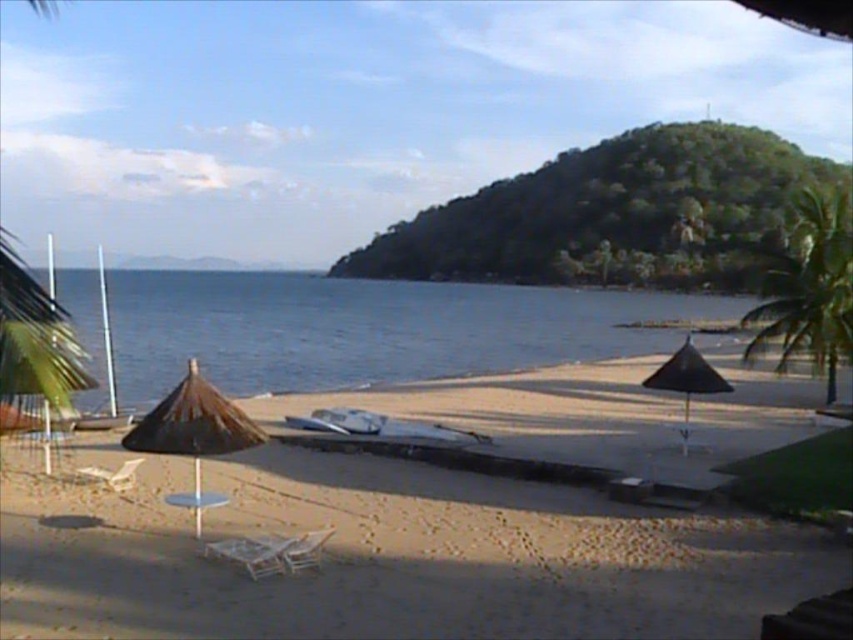
You are standing at the beach and want to place a small flag between the two points, point [187,396] and point [314,557]. Which point is closer to you so that you can reach it first?

Point [187,396] is further to the camera than point [314,557], so point [314,557] is closer to you and you can reach it first.

You are standing at the center of the beach and want to place a new umbrella exactly halfway between the brown woven umbrella at left and another object. However, there are no other umbrellas except the one mentioned. Can you determine the coordinates where the new umbrella should be placed?

Since there are no other umbrellas besides the brown woven umbrella at left, it is not possible to determine the halfway point between two umbrellas as only one is present.

You are a beachgoer who wants to place a cooler between the blue water at center and the wooden beach chair at center. Which object should you place it closer to to ensure it stays dry?

The blue water at center is located above the wooden beach chair at center, so placing the cooler closer to the wooden beach chair at center will keep it away from the water and ensure it stays dry.